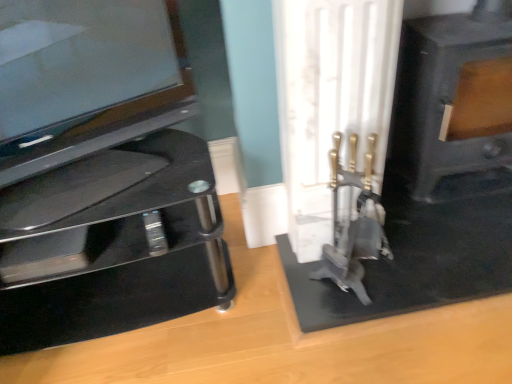
Question: From a real-world perspective, is black glass tv stand at left physically above glossy black tv at left?

Choices:
 (A) no
 (B) yes

Answer: (A)

Question: Is black glass tv stand at left oriented towards glossy black tv at left?

Choices:
 (A) yes
 (B) no

Answer: (B)

Question: Does black glass tv stand at left have a larger size compared to glossy black tv at left?

Choices:
 (A) yes
 (B) no

Answer: (A)

Question: Is black glass tv stand at left closer to the viewer compared to glossy black tv at left?

Choices:
 (A) yes
 (B) no

Answer: (B)

Question: Can you confirm if black glass tv stand at left is shorter than glossy black tv at left?

Choices:
 (A) yes
 (B) no

Answer: (B)

Question: Is black glass tv stand at left thinner than glossy black tv at left?

Choices:
 (A) yes
 (B) no

Answer: (B)

Question: Would you consider black glass tv stand at left to be distant from black matte fireplace at right?

Choices:
 (A) yes
 (B) no

Answer: (A)

Question: Can you confirm if black glass tv stand at left is taller than black matte fireplace at right?

Choices:
 (A) yes
 (B) no

Answer: (B)

Question: Is black glass tv stand at left smaller than black matte fireplace at right?

Choices:
 (A) no
 (B) yes

Answer: (A)

Question: Can you confirm if black glass tv stand at left is positioned to the left of black matte fireplace at right?

Choices:
 (A) no
 (B) yes

Answer: (B)

Question: Is black glass tv stand at left not inside black matte fireplace at right?

Choices:
 (A) yes
 (B) no

Answer: (A)

Question: Is black glass tv stand at left placed right next to black matte fireplace at right?

Choices:
 (A) no
 (B) yes

Answer: (A)

Question: From the image's perspective, is glossy black tv at left under black matte fireplace at right?

Choices:
 (A) no
 (B) yes

Answer: (B)